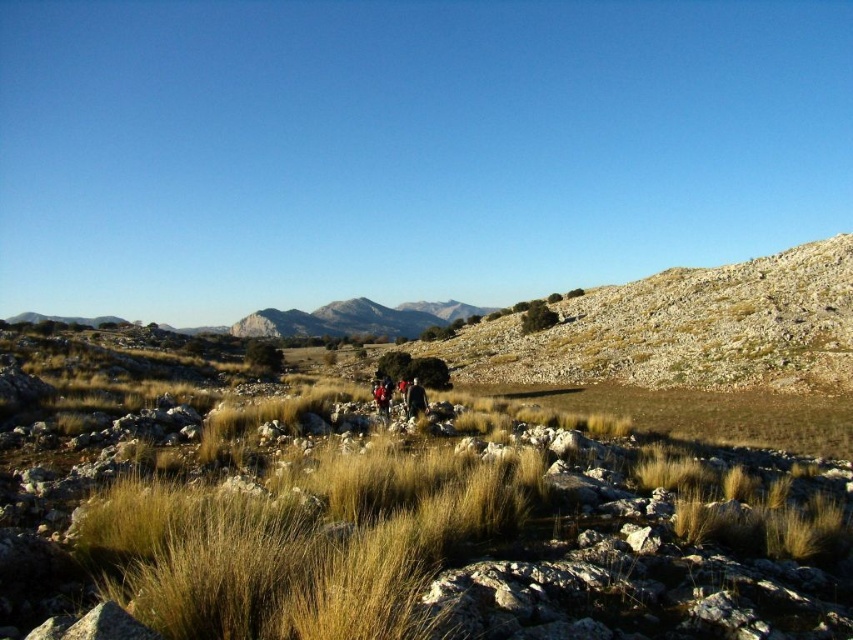
You are a hiker planning to take a photo of the rugged brown mountain at center and the dark brown leather jacket at center. Which object should you focus on first if you want both to be in sharp focus?

The rugged brown mountain at center is positioned over dark brown leather jacket at center, so you should focus on the rugged brown mountain at center first to ensure both are in sharp focus.

You are a hiker who wants to take a photo of the red fabric person at center and the dry grass at center. Which object should you focus on first if you want both to be in sharp focus?

The dry grass at center is positioned under the red fabric person at center, so focusing on the red fabric person at center first will ensure both are in focus since it is farther away from the camera than the dry grass at center.